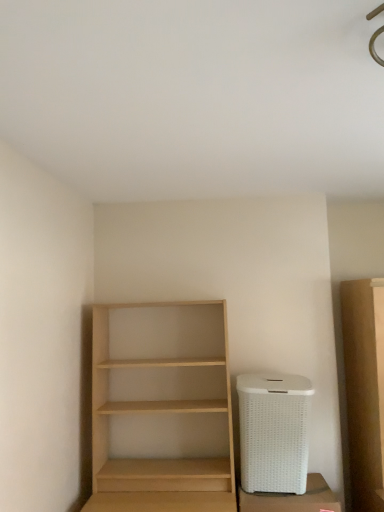
Question: Is light wood shelf at center wider or thinner than white wicker laundry basket at lower right?

Choices:
 (A) wide
 (B) thin

Answer: (A)

Question: Is light wood shelf at center bigger or smaller than white wicker laundry basket at lower right?

Choices:
 (A) small
 (B) big

Answer: (B)

Question: Which object is positioned closest to the white wicker laundry basket at lower right?

Choices:
 (A) white wicker trash can at lower right
 (B) light wood shelf at center

Answer: (A)

Question: Which object is the farthest from the light wood shelf at center?

Choices:
 (A) white wicker laundry basket at lower right
 (B) white wicker trash can at lower right

Answer: (B)